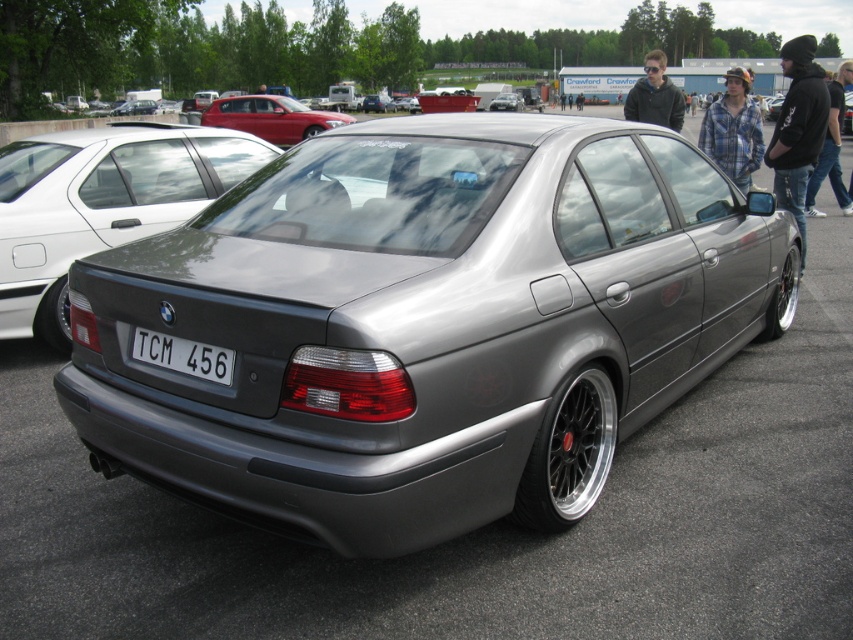
You are a photographer trying to capture the entire satin silver sedan at center and the white plastic license plate at center in a single frame. Based on their sizes, will you need to zoom in or out to ensure both are fully visible?

The white plastic license plate at center is not as tall as the satin silver sedan at center, so you will need to zoom out to ensure both are fully visible in the frame.